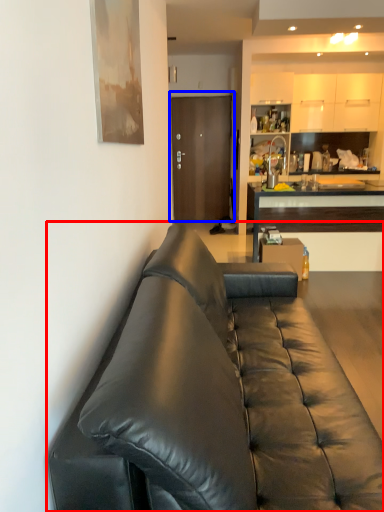
Question: Which point is closer to the camera, studio couch (highlighted by a red box) or door (highlighted by a blue box)?

Choices:
 (A) studio couch
 (B) door

Answer: (A)